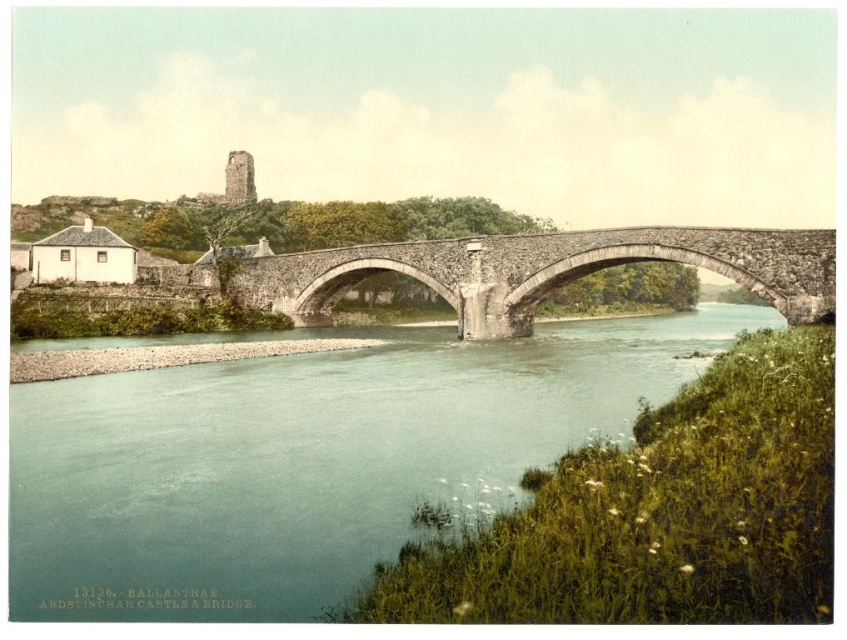
You are standing at the stone bridge and want to reach the point marked at coordinates (154, 397). Given that the bridge is 150 feet long, can you safely walk from the bridge to that point without needing to cross the river?

The point marked at coordinates (154, 397) is 222.38 feet away from the viewer. Since the bridge is only 150 feet long, you would need to walk beyond the bridge to reach it, which might require crossing the river or finding another path. Therefore, you cannot safely walk directly from the bridge to that point without crossing the river.

You are an architect designing a new pathway that needs to cross the river. The pathway must be elevated enough to avoid flooding during heavy rains. Considering the clear blue water at center and the stone arch bridge at center, which one has a higher elevation point that could guide your design?

The clear blue water at center has a greater height compared to the stone arch bridge at center, so the pathway should be designed to match or exceed the elevation of the clear blue water at center to avoid flooding.

You are standing on the riverbank and want to take a photo of the stone arch bridge at center. However, there is clear blue water at center blocking your view. Can you adjust your position to capture the bridge without the water obstructing it?

The clear blue water at center is closer to the viewer than the stone arch bridge at center. To avoid the water obstructing the bridge, you should move your position to either the left or right side of the current viewpoint so that the stone arch bridge at center is no longer behind the clear blue water at center.